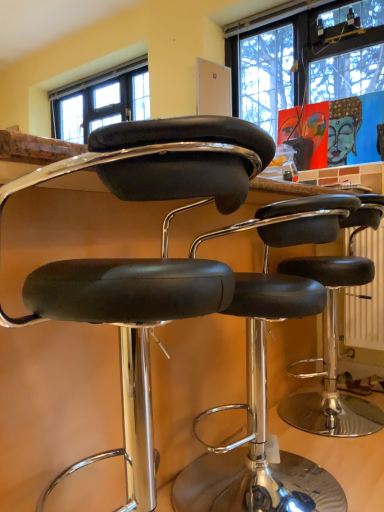
Question: From the image's perspective, would you say black leather stool at center, the 1th chair viewed from the back, is positioned over black leather stool at center, which is counted as the second chair, starting from the back?

Choices:
 (A) no
 (B) yes

Answer: (A)

Question: Is the depth of black leather stool at center, which is the second chair in front-to-back order, greater than that of black leather stool at center, which is counted as the second chair, starting from the back?

Choices:
 (A) yes
 (B) no

Answer: (A)

Question: Does black leather stool at center, which is the second chair in front-to-back order, have a greater height compared to black leather stool at center, which is counted as the second chair, starting from the back?

Choices:
 (A) no
 (B) yes

Answer: (A)

Question: Considering the relative sizes of black leather stool at center, the 1th chair viewed from the back, and black leather stool at center, which is the 1th chair from front to back, in the image provided, is black leather stool at center, the 1th chair viewed from the back, wider than black leather stool at center, which is the 1th chair from front to back,?

Choices:
 (A) no
 (B) yes

Answer: (B)

Question: From a real-world perspective, does black leather stool at center, which is the second chair in front-to-back order, sit lower than black leather stool at center, which is the 1th chair from front to back?

Choices:
 (A) yes
 (B) no

Answer: (A)

Question: Is black leather stool at center, the 1th chair viewed from the back, to the right of black leather stool at center, which is the 1th chair from front to back, from the viewer's perspective?

Choices:
 (A) yes
 (B) no

Answer: (A)

Question: Are black leather stool at center, which is counted as the second chair, starting from the back, and black leather stool at center, the 1th chair viewed from the back, making contact?

Choices:
 (A) no
 (B) yes

Answer: (A)

Question: From the image's perspective, is black leather stool at center, which is the 1th chair from front to back, above black leather stool at center, which is the second chair in front-to-back order?

Choices:
 (A) no
 (B) yes

Answer: (B)

Question: Does black leather stool at center, which is counted as the second chair, starting from the back, have a lesser width compared to black leather stool at center, which is the second chair in front-to-back order?

Choices:
 (A) no
 (B) yes

Answer: (B)

Question: Is black leather stool at center, which is counted as the second chair, starting from the back, to the left of black leather stool at center, the 1th chair viewed from the back, from the viewer's perspective?

Choices:
 (A) yes
 (B) no

Answer: (A)

Question: Could you tell me if black leather stool at center, which is the 1th chair from front to back, is facing black leather stool at center, which is the second chair in front-to-back order?

Choices:
 (A) yes
 (B) no

Answer: (B)

Question: Is black leather stool at center, the 1th chair viewed from the back, in front of or behind black leather stool at center, which is counted as the second chair, starting from the back, in the image?

Choices:
 (A) behind
 (B) front

Answer: (A)